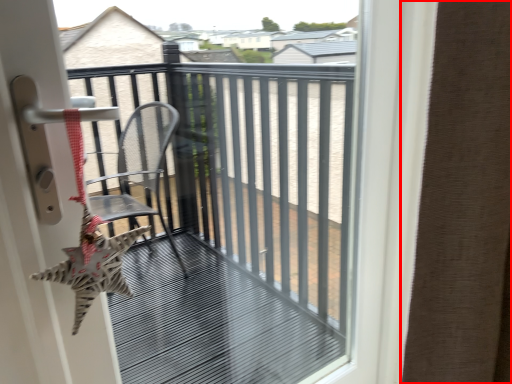
Question: Observing the image, what is the correct spatial positioning of curtain (annotated by the red box) in reference to balcony?

Choices:
 (A) right
 (B) left

Answer: (A)